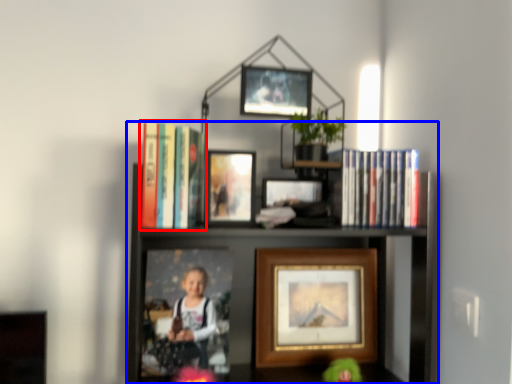
Question: Which of the following is the closest to the observer, book (highlighted by a red box) or shelf (highlighted by a blue box)?

Choices:
 (A) book
 (B) shelf

Answer: (B)